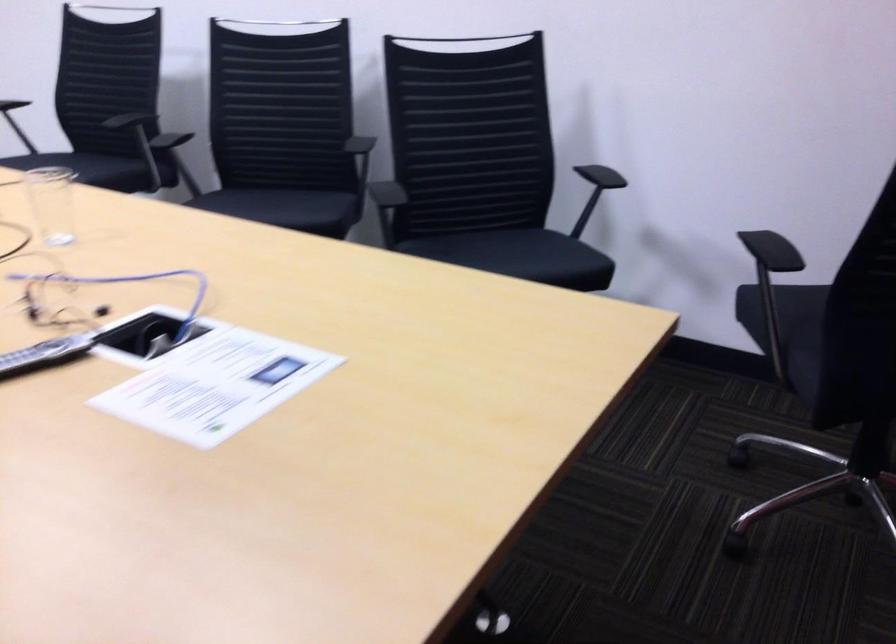
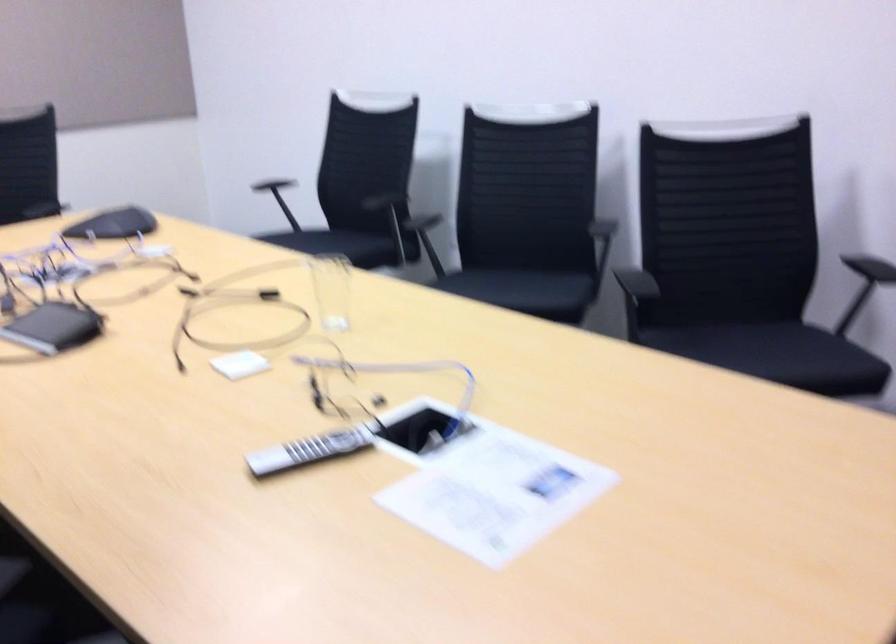
In the second image, find the point that corresponds to the point at 102,169 in the first image.

(350, 245)